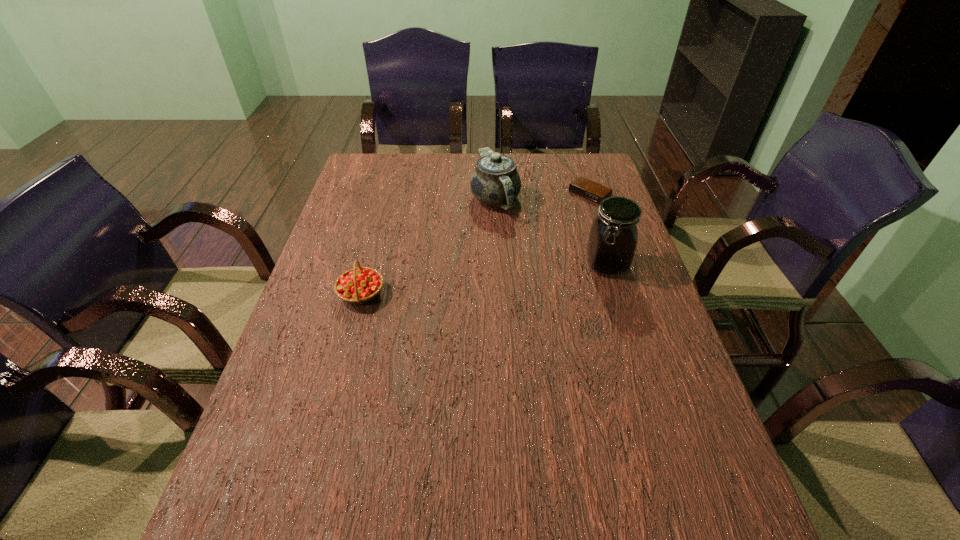
You are a GUI agent. You are given a task and a screenshot of the screen. Output one action in this format:
    pyautogui.click(x=<x>, y=<y>)
    Task: Click on the vacant space on the desktop that is between the second shortest object and the jar and is positioned on the front face of the alarm clock
    The image size is (960, 540).
    Given the screenshot: What is the action you would take?
    pyautogui.click(x=475, y=280)

Image resolution: width=960 pixels, height=540 pixels. In order to click on free spot on the desktop that is between the leftmost object and the jar and is positioned from the spout of the second tallest object in this screenshot , I will do tap(498, 277).